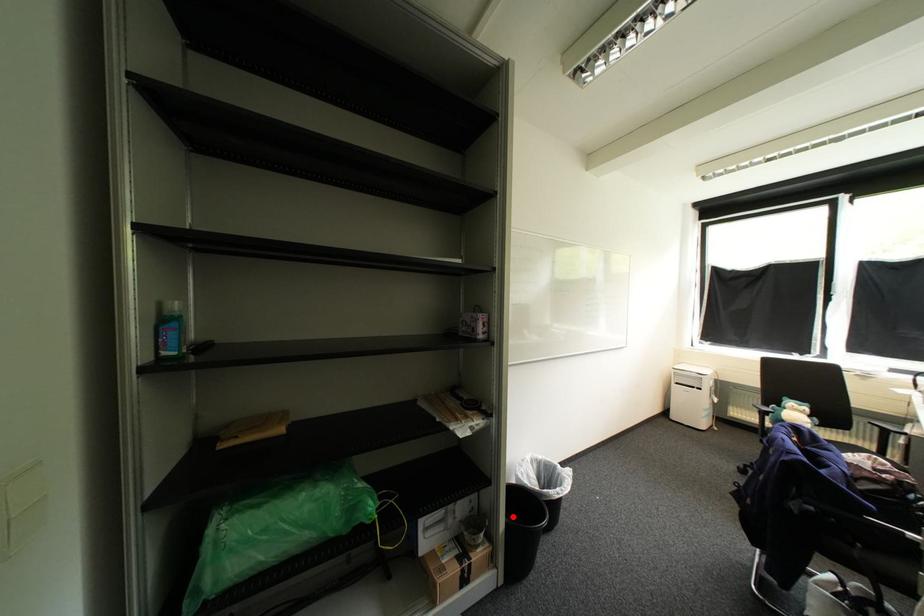
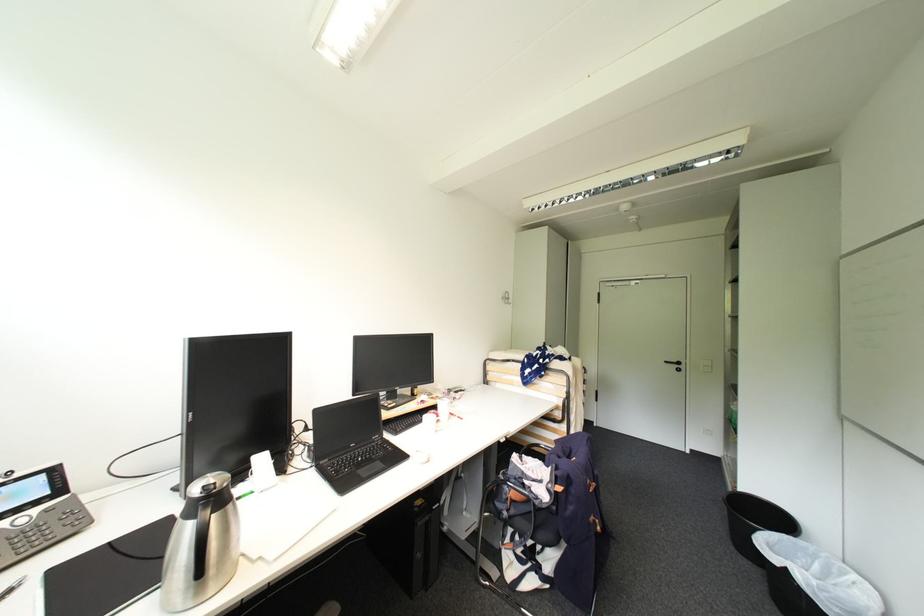
Question: I am providing you with two images of the same scene from different viewpoints. A red point is marked on the first image. At the location where the point appears in image 1, is it still visible in image 2?

Choices:
 (A) Yes
 (B) No

Answer: (B)